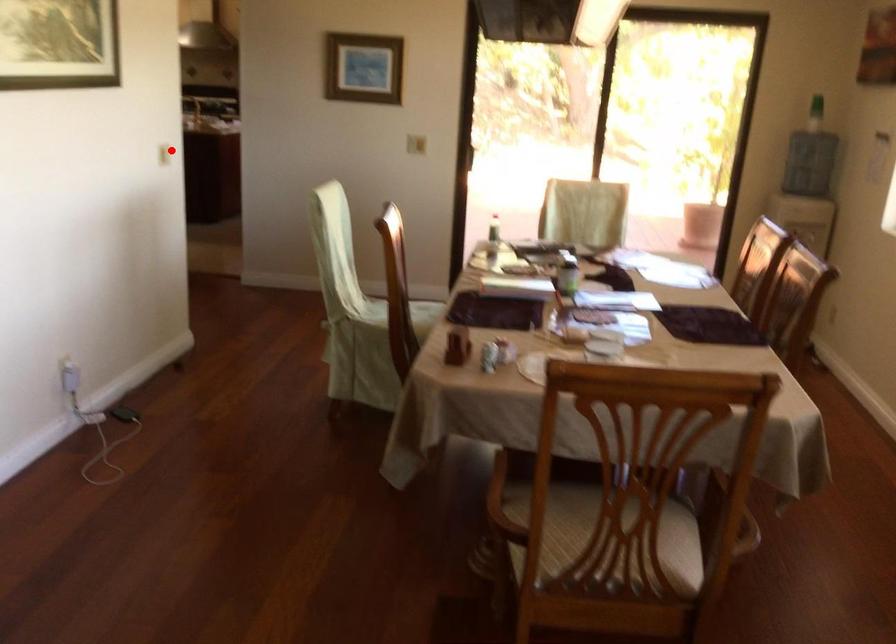
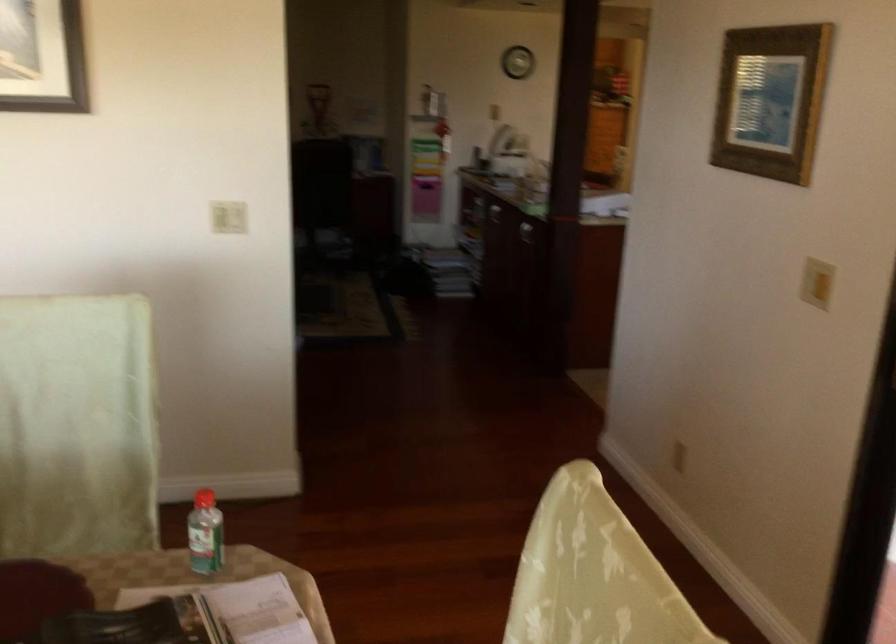
The point at the highlighted location is marked in the first image. Where is the corresponding point in the second image?

(228, 216)